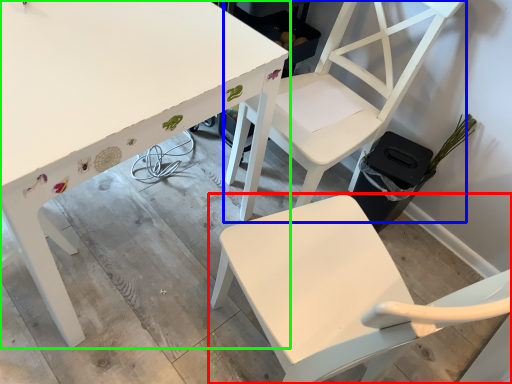
Question: Based on their relative distances, which object is nearer to chair (highlighted by a red box)? Choose from chair (highlighted by a blue box) and table (highlighted by a green box).

Choices:
 (A) chair
 (B) table

Answer: (A)